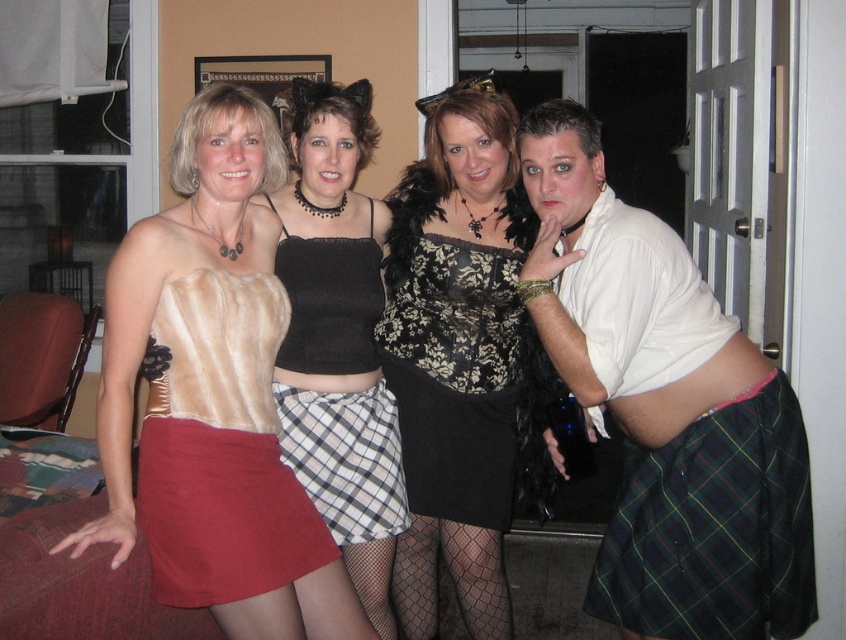
You are a photographer trying to capture a group photo of the black lace dress at center and the black lace top at center. The camera you are using has a minimum focus distance of 7 inches. Can you focus on both subjects simultaneously without moving the camera?

The distance between the black lace dress at center and the black lace top at center is 7.65 inches, which is greater than the camera minimum focus distance of 7 inches. Therefore, you can focus on both subjects simultaneously without moving the camera.

You are standing in the living room and see two black lace garments at center. Which one is closer to you, the black lace dress at center or the black lace top at center?

The black lace dress at center is closer to you because it is further to the viewer than the black lace top at center.

You are a photographer setting up for a group photo. You need to ensure all subjects are within the camera frame. The camera has a width of 15 inches. The satin skirt at lower left and plaid fabric skirt at center are the two closest subjects. Can both be captured in the frame without moving the camera?

The distance between the satin skirt at lower left and plaid fabric skirt at center is 13.66 inches, which is less than the camera frame width of 15 inches. Therefore, both can be captured in the frame without moving the camera.